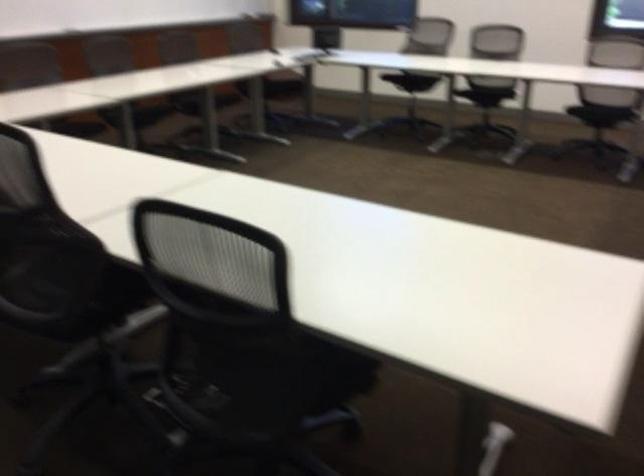
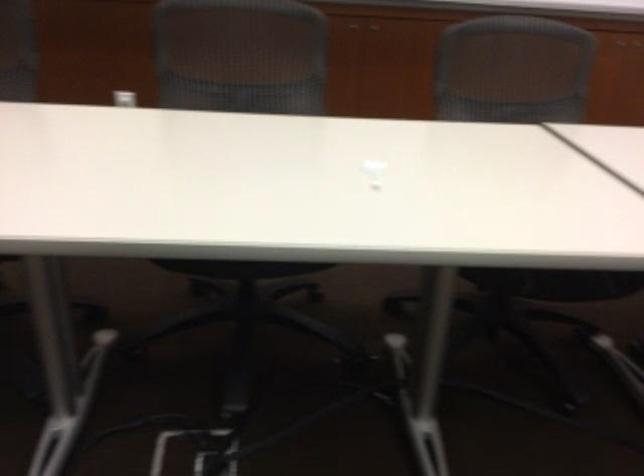
Find the pixel in the second image that matches (152,108) in the first image.

(239, 268)